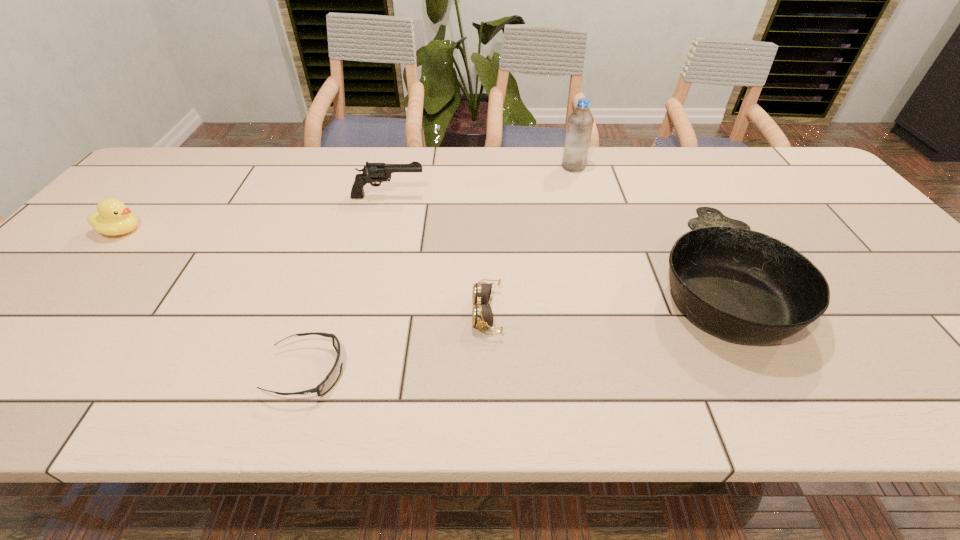
Locate an element on the screen. The width and height of the screenshot is (960, 540). empty space that is in between the frying pan and the tallest object is located at coordinates (646, 226).

I want to click on vacant area between the right goggles and the duckling, so click(x=304, y=272).

This screenshot has width=960, height=540. I want to click on free spot between the leftmost object and the nearer goggles, so pyautogui.click(x=214, y=301).

Identify the location of free spot between the right goggles and the gun. Image resolution: width=960 pixels, height=540 pixels. (438, 255).

Identify the location of blank region between the rightmost object and the gun. tap(553, 241).

Identify the location of free space between the farther goggles and the frying pan. (603, 299).

Find the location of a particular element. Image resolution: width=960 pixels, height=540 pixels. object that is the third closest to the duckling is located at coordinates (482, 316).

Select which object appears as the fifth closest to the second farthest object. Please provide its 2D coordinates. Your answer should be formatted as a tuple, i.e. [(x, y)], where the tuple contains the x and y coordinates of a point satisfying the conditions above.

[(742, 285)]

Locate an element on the screen. The image size is (960, 540). vacant region that satisfies the following two spatial constraints: 1. with the handle extending from the side of the frying pan; 2. on the beak of the leftmost object is located at coordinates (690, 231).

Identify the location of free space in the image that satisfies the following two spatial constraints: 1. on the front side of the farthest object; 2. on the beak of the leftmost object. (591, 231).